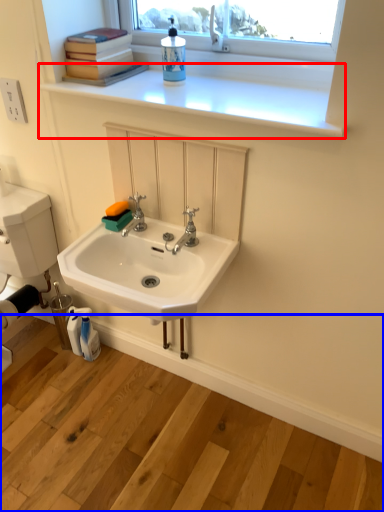
Question: Which point is closer to the camera, window sill (highlighted by a red box) or counter (highlighted by a blue box)?

Choices:
 (A) window sill
 (B) counter

Answer: (B)